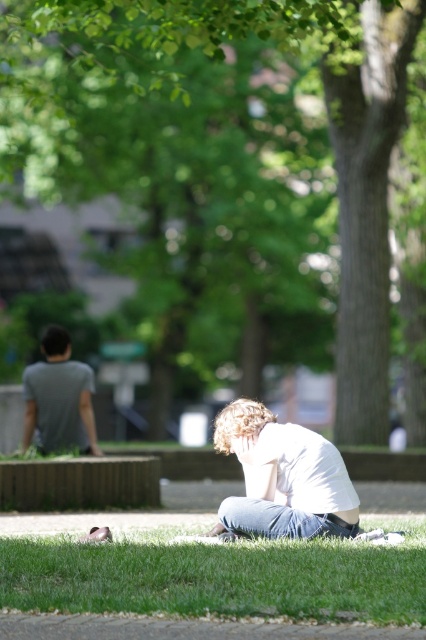
Between green grass at lower center and white cotton shirt at lower center, which one appears on the left side from the viewer's perspective?

Positioned to the left is green grass at lower center.

Is point (423, 592) positioned before point (270, 472)?

That is True.

Describe the element at coordinates (210, 572) in the screenshot. I see `green grass at lower center` at that location.

Image resolution: width=426 pixels, height=640 pixels. Identify the location of green grass at lower center. (210, 572).

Based on the photo, who is taller, green grass at lower center or gray cotton t-shirt at left?

Standing taller between the two is gray cotton t-shirt at left.

Can you confirm if green grass at lower center is shorter than gray cotton t-shirt at left?

Correct, green grass at lower center is not as tall as gray cotton t-shirt at left.

Find the location of `green grass at lower center`. green grass at lower center is located at coordinates (210, 572).

Identify the location of green grass at lower center. (210, 572).

Who is higher up, green leafy tree at upper center or green grass at lower center?

green leafy tree at upper center is above.

Measure the distance between point (293, 52) and camera.

16.15 meters

Where is `green leafy tree at upper center`? Image resolution: width=426 pixels, height=640 pixels. green leafy tree at upper center is located at coordinates (224, 168).